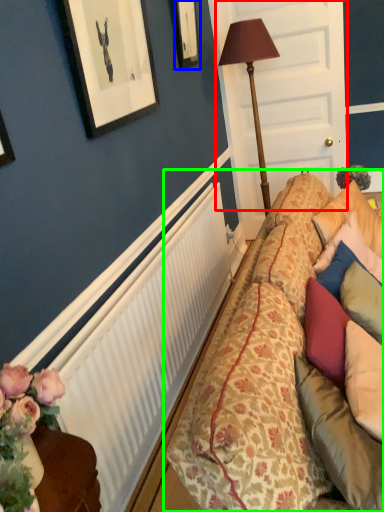
Question: Which is farther away from door (highlighted by a red box)? picture frame (highlighted by a blue box) or studio couch (highlighted by a green box)?

Choices:
 (A) picture frame
 (B) studio couch

Answer: (B)